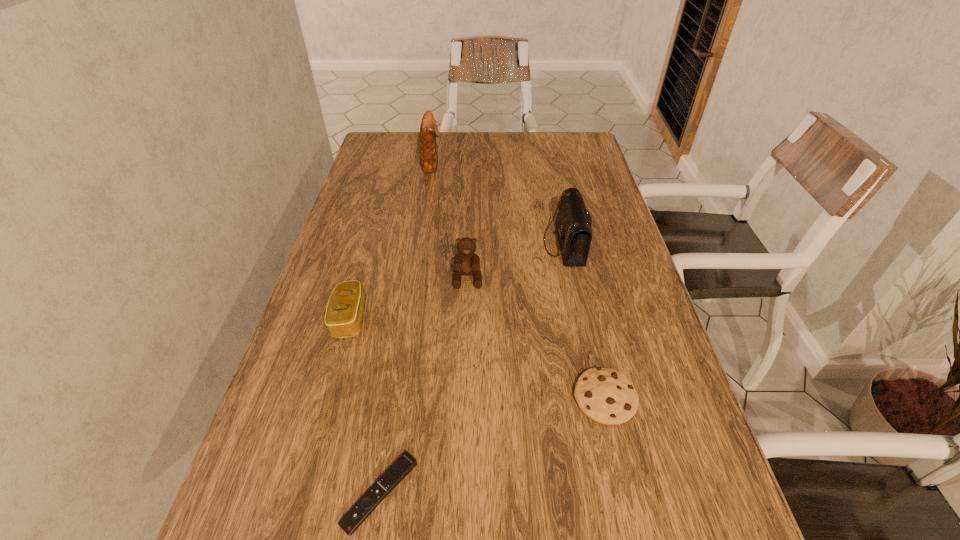
Identify the location of the shortest object. click(x=351, y=521).

Image resolution: width=960 pixels, height=540 pixels. In order to click on remote control in this screenshot , I will do coord(351,521).

Where is `vacant space located 0.110m on the open side of the farthest clutch bag`? vacant space located 0.110m on the open side of the farthest clutch bag is located at coordinates (475, 164).

Identify the location of vacant region located 0.070m on the front flap of the second nearest clutch bag. (517, 244).

Where is `free point located 0.280m on the front flap of the second nearest clutch bag`? The image size is (960, 540). free point located 0.280m on the front flap of the second nearest clutch bag is located at coordinates (438, 244).

Locate an element on the screen. The image size is (960, 540). free space located 0.200m on the front flap of the second nearest clutch bag is located at coordinates (468, 244).

You are a GUI agent. You are given a task and a screenshot of the screen. Output one action in this format:
    pyautogui.click(x=<x>, y=<y>)
    Task: Click on the vacant space located on the face of the fourth nearest object
    This screenshot has width=960, height=540.
    Given the screenshot: What is the action you would take?
    pyautogui.click(x=465, y=372)

Identify the location of vacant area located 0.260m on the zipper side of the third nearest object. (485, 318).

The width and height of the screenshot is (960, 540). Find the location of `free space located 0.260m on the back of the cookie`. free space located 0.260m on the back of the cookie is located at coordinates (578, 280).

I want to click on free point located 0.110m on the right of the nearest object, so click(x=483, y=493).